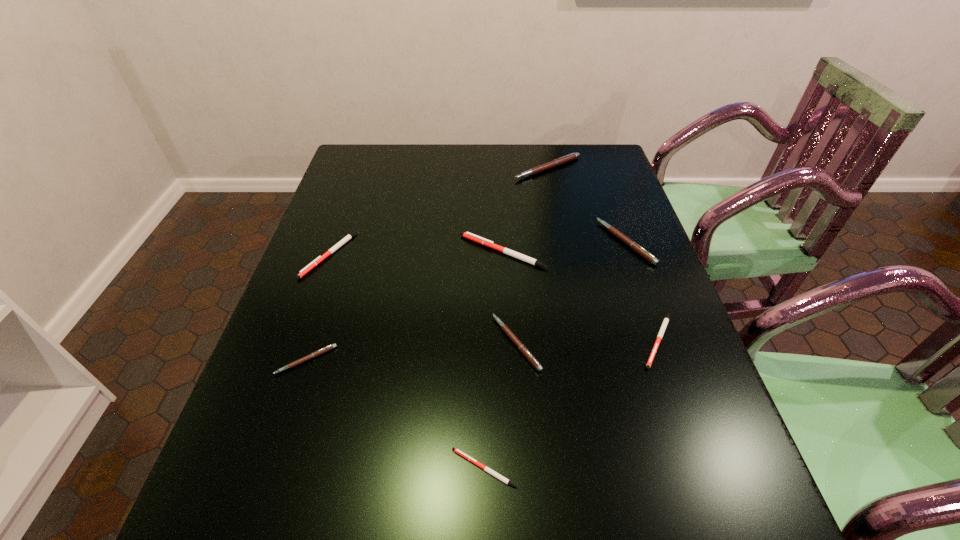
I want to click on pink pen that is the closest to the smallest pink pen, so click(522, 348).

Locate which white pen is the third closest to the leftmost pink pen. Please provide its 2D coordinates. Your answer should be formatted as a tuple, i.e. [(x, y)], where the tuple contains the x and y coordinates of a point satisfying the conditions above.

[(473, 237)]

The width and height of the screenshot is (960, 540). Find the location of `white pen that is the third closest to the shortest object`. white pen that is the third closest to the shortest object is located at coordinates (319, 259).

At what (x,y) coordinates should I click in order to perform the action: click on free space that satisfies the following two spatial constraints: 1. at the nib of the third smallest pink pen; 2. on the clicker of the rightmost white pen. Please return your answer as a coordinate pair (x, y). Looking at the image, I should click on (660, 340).

In order to click on free location that satisfies the following two spatial constraints: 1. on the clicker of the biggest white pen; 2. at the nib of the leftmost pink pen in this screenshot , I will do `click(509, 360)`.

Where is `vacant position in the image that satisfies the following two spatial constraints: 1. at the nib of the second farthest pink pen; 2. on the clicker of the rightmost white pen`? This screenshot has height=540, width=960. vacant position in the image that satisfies the following two spatial constraints: 1. at the nib of the second farthest pink pen; 2. on the clicker of the rightmost white pen is located at coordinates (660, 340).

This screenshot has width=960, height=540. I want to click on vacant space that satisfies the following two spatial constraints: 1. on the clicker of the biggest white pen; 2. at the nib of the smallest pink pen, so click(x=509, y=360).